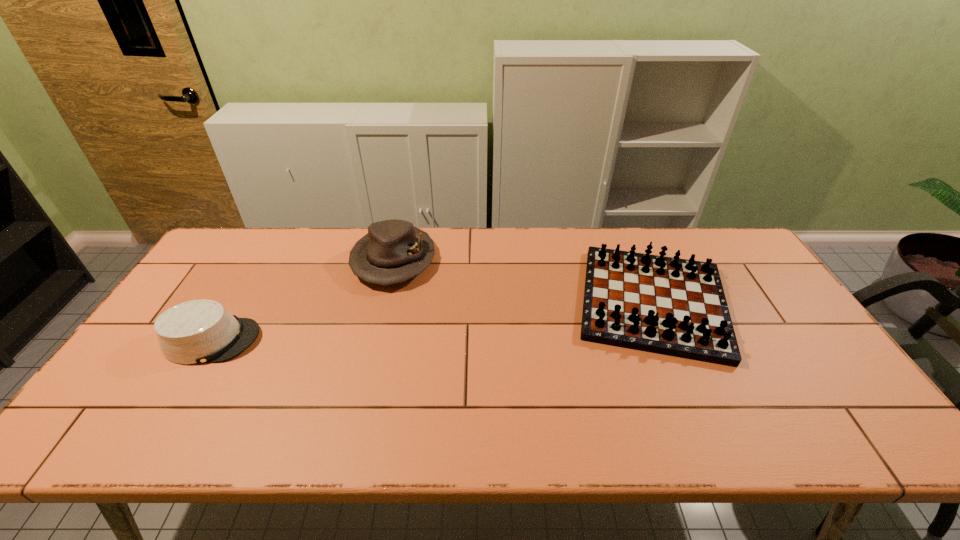
Image resolution: width=960 pixels, height=540 pixels. Identify the location of empty space that is in between the chessboard and the taller hat. (523, 281).

You are a GUI agent. You are given a task and a screenshot of the screen. Output one action in this format:
    pyautogui.click(x=<x>, y=<y>)
    Task: Click on the vacant space in between the shortest object and the farther hat
    Image resolution: width=960 pixels, height=540 pixels.
    Given the screenshot: What is the action you would take?
    pyautogui.click(x=303, y=300)

Identify the location of free point between the chessboard and the taller hat. Image resolution: width=960 pixels, height=540 pixels. (523, 281).

This screenshot has width=960, height=540. What are the coordinates of `blank region between the chessboard and the nearer hat` in the screenshot? It's located at (433, 321).

Where is `empty location between the chessboard and the taller hat`? Image resolution: width=960 pixels, height=540 pixels. empty location between the chessboard and the taller hat is located at coordinates (523, 281).

Find the location of `vacant area that lies between the taller hat and the leftmost object`. vacant area that lies between the taller hat and the leftmost object is located at coordinates (303, 300).

Where is `unoccupied area between the taller hat and the chessboard`? unoccupied area between the taller hat and the chessboard is located at coordinates click(x=523, y=281).

Where is `free point between the chessboard and the shortest object`? This screenshot has width=960, height=540. free point between the chessboard and the shortest object is located at coordinates (433, 321).

At what (x,y) coordinates should I click in order to perform the action: click on unoccupied position between the chessboard and the farther hat. Please return your answer as a coordinate pair (x, y). Looking at the image, I should click on (523, 281).

Locate which object is the closest to the farther hat. Please provide its 2D coordinates. Your answer should be formatted as a tuple, i.e. [(x, y)], where the tuple contains the x and y coordinates of a point satisfying the conditions above.

[(200, 331)]